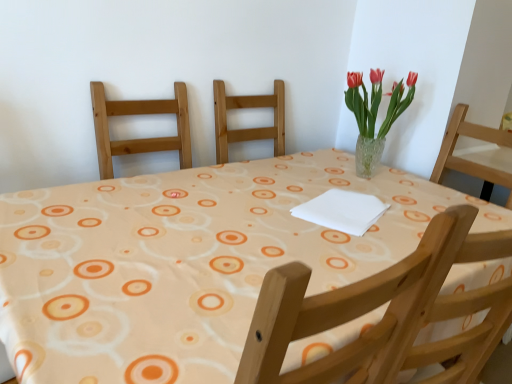
Describe the element at coordinates (374, 115) in the screenshot. I see `translucent glass vase at upper right` at that location.

You are a GUI agent. You are given a task and a screenshot of the screen. Output one action in this format:
    pyautogui.click(x=<x>, y=<y>)
    Task: Click on the translucent glass vase at upper right
    The width and height of the screenshot is (512, 384).
    Given the screenshot: What is the action you would take?
    pyautogui.click(x=374, y=115)

What do you see at coordinates (186, 262) in the screenshot?
I see `matte orange tablecloth at center` at bounding box center [186, 262].

In order to face matte orange tablecloth at center, should I rotate leftwards or rightwards?

Rotate your view left by about 2.220°.

This screenshot has width=512, height=384. What are the coordinates of `matte orange tablecloth at center` in the screenshot? It's located at (186, 262).

Measure the distance between matte orange tablecloth at center and camera.

They are 25.06 inches apart.

In order to click on translucent glass vase at upper right in this screenshot , I will do `click(374, 115)`.

Can you confirm if matte orange tablecloth at center is positioned to the right of translucent glass vase at upper right?

Incorrect, matte orange tablecloth at center is not on the right side of translucent glass vase at upper right.

Is matte orange tablecloth at center positioned behind translucent glass vase at upper right?

No, the depth of matte orange tablecloth at center is less than that of translucent glass vase at upper right.

Is point (185, 291) closer or farther from the camera than point (364, 155)?

Point (185, 291) is closer to the camera than point (364, 155).

From the image's perspective, is matte orange tablecloth at center located above translucent glass vase at upper right?

Actually, matte orange tablecloth at center appears below translucent glass vase at upper right in the image.

From a real-world perspective, is matte orange tablecloth at center located higher than translucent glass vase at upper right?

No.

Which of these two, matte orange tablecloth at center or translucent glass vase at upper right, is thinner?

With smaller width is translucent glass vase at upper right.

In terms of height, does matte orange tablecloth at center look taller or shorter compared to translucent glass vase at upper right?

Considering their sizes, matte orange tablecloth at center has more height than translucent glass vase at upper right.

Between matte orange tablecloth at center and translucent glass vase at upper right, which one has larger size?

matte orange tablecloth at center.

Is matte orange tablecloth at center situated inside translucent glass vase at upper right or outside?

matte orange tablecloth at center lies outside translucent glass vase at upper right.

Is matte orange tablecloth at center not close to translucent glass vase at upper right?

They are positioned close to each other.

Is matte orange tablecloth at center aimed at translucent glass vase at upper right?

No.

How many degrees apart are the facing directions of matte orange tablecloth at center and translucent glass vase at upper right?

87.9 degrees separate the facing orientations of matte orange tablecloth at center and translucent glass vase at upper right.

Find the location of `table to the left of translucent glass vase at upper right`. table to the left of translucent glass vase at upper right is located at coordinates (186, 262).

Is translucent glass vase at upper right at the left side of matte orange tablecloth at center?

No, translucent glass vase at upper right is not to the left of matte orange tablecloth at center.

Is the depth of translucent glass vase at upper right less than that of matte orange tablecloth at center?

No, translucent glass vase at upper right is behind matte orange tablecloth at center.

Between point (357, 167) and point (164, 299), which one is positioned in front?

Positioned in front is point (164, 299).

From the image's perspective, between translucent glass vase at upper right and matte orange tablecloth at center, which one is located above?

translucent glass vase at upper right.

From a real-world perspective, is translucent glass vase at upper right physically above matte orange tablecloth at center?

Yes, from a real-world perspective, translucent glass vase at upper right is over matte orange tablecloth at center

Looking at this image, considering the sizes of objects translucent glass vase at upper right and matte orange tablecloth at center in the image provided, who is thinner, translucent glass vase at upper right or matte orange tablecloth at center?

With smaller width is translucent glass vase at upper right.

Considering the sizes of translucent glass vase at upper right and matte orange tablecloth at center in the image, is translucent glass vase at upper right taller or shorter than matte orange tablecloth at center?

In the image, translucent glass vase at upper right appears to be shorter than matte orange tablecloth at center.

Can you confirm if translucent glass vase at upper right is bigger than matte orange tablecloth at center?

Actually, translucent glass vase at upper right might be smaller than matte orange tablecloth at center.

Is translucent glass vase at upper right not within matte orange tablecloth at center?

Indeed, translucent glass vase at upper right is completely outside matte orange tablecloth at center.

Is translucent glass vase at upper right not close to matte orange tablecloth at center?

No, translucent glass vase at upper right is not far from matte orange tablecloth at center.

Is translucent glass vase at upper right positioned with its back to matte orange tablecloth at center?

translucent glass vase at upper right is not turned away from matte orange tablecloth at center.

The image size is (512, 384). I want to click on floral arrangement above the matte orange tablecloth at center (from a real-world perspective), so click(374, 115).

At what (x,y) coordinates should I click in order to perform the action: click on floral arrangement above the matte orange tablecloth at center (from a real-world perspective). Please return your answer as a coordinate pair (x, y). Looking at the image, I should click on (374, 115).

You are a GUI agent. You are given a task and a screenshot of the screen. Output one action in this format:
    pyautogui.click(x=<x>, y=<y>)
    Task: Click on the table that is on the left side of translucent glass vase at upper right
    
    Given the screenshot: What is the action you would take?
    pyautogui.click(x=186, y=262)